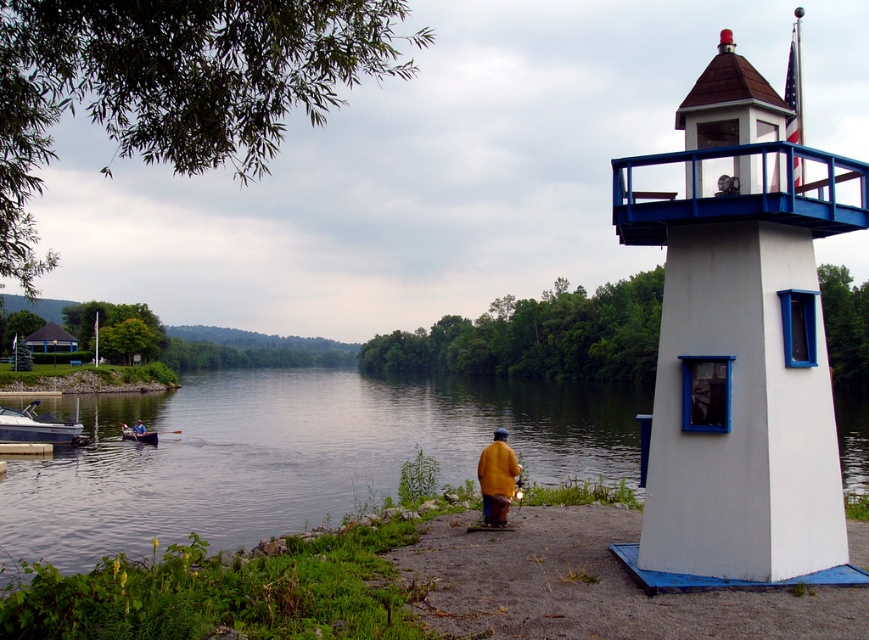
Is white glossy boat at left behind wooden canoe at left?

That is False.

Does white glossy boat at left appear over wooden canoe at left?

Indeed, white glossy boat at left is positioned over wooden canoe at left.

Who is more distant from viewer, (40, 440) or (123, 428)?

The point (123, 428) is behind.

The height and width of the screenshot is (640, 869). Find the location of `white glossy boat at left`. white glossy boat at left is located at coordinates (37, 426).

Is smooth water at center in front of white glossy boat at left?

Yes, smooth water at center is closer to the viewer.

This screenshot has height=640, width=869. What do you see at coordinates (294, 454) in the screenshot? I see `smooth water at center` at bounding box center [294, 454].

At what (x,y) coordinates should I click in order to perform the action: click on smooth water at center. Please return your answer as a coordinate pair (x, y). Image resolution: width=869 pixels, height=640 pixels. Looking at the image, I should click on (294, 454).

Who is lower down, white painted wood lighthouse at right or yellow matte jacket at lower center?

Positioned lower is yellow matte jacket at lower center.

Who is more distant from viewer, (678, 273) or (131, 428)?

Point (131, 428)

Find the location of a particular element. The width and height of the screenshot is (869, 640). white painted wood lighthouse at right is located at coordinates (740, 342).